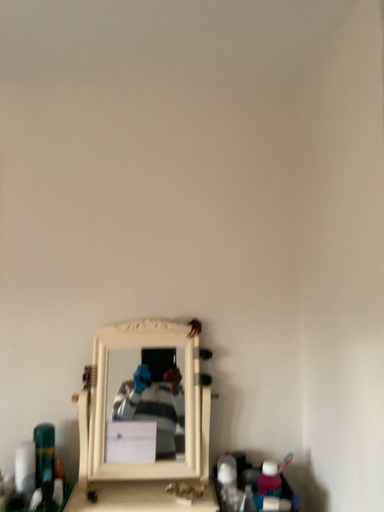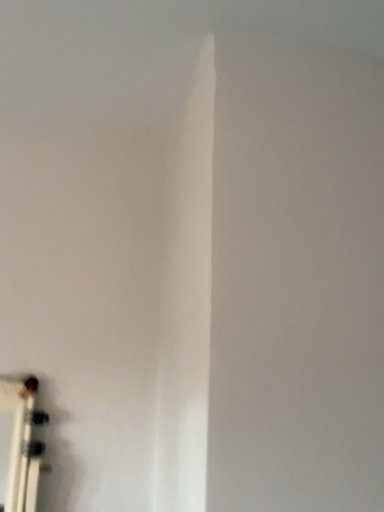
Question: Which way did the camera rotate in the video?

Choices:
 (A) rotated upward
 (B) rotated downward

Answer: (A)